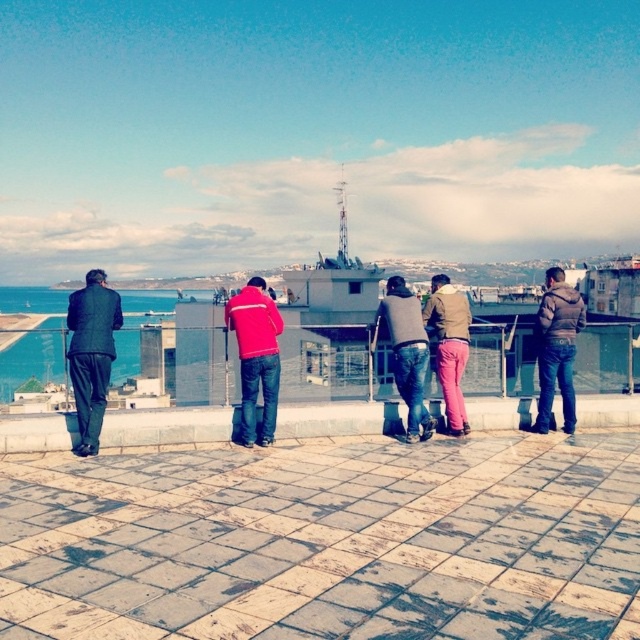
You are a photographer trying to capture a group photo of the dark gray suit at left and the red fleece jacket at center. Since you want to ensure both subjects are in focus, you need to know which one is closer to the camera. Can you determine which is nearer?

The dark gray suit at left has a larger size compared to red fleece jacket at center, so the dark gray suit at left is closer to the camera because objects closer to the camera appear larger.

You are a photographer trying to capture a group photo of the dark gray suit at left and the red fleece jacket at center. If you want to ensure both subjects are in focus, which one should you adjust your camera focus to prioritize based on their sizes?

The dark gray suit at left is wider than the red fleece jacket at center, so you should prioritize focusing on the dark gray suit at left because larger objects often require more precise focus to maintain clarity across their entire form.

You are a photographer trying to capture a group photo of the dark gray suit at left and the red fleece jacket at center. The camera you are using has a minimum focusing distance of 2 meters. Will you be able to take a clear photo of both subjects without moving either of them?

The distance between the dark gray suit at left and the red fleece jacket at center is 2.15 meters, which is greater than the camera minimum focusing distance of 2 meters. Therefore, you can take a clear photo of both subjects without moving them.